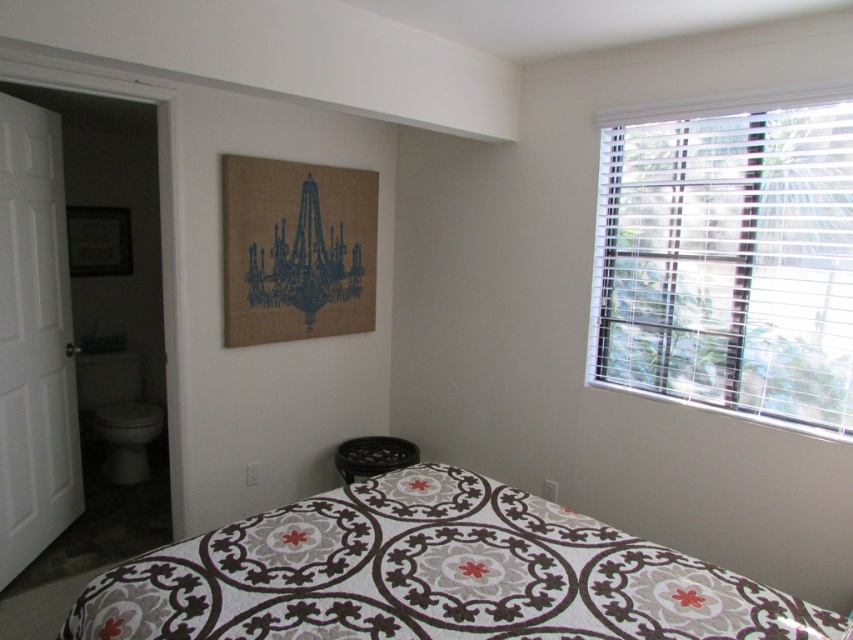
Question: Which object is closer to the camera taking this photo?

Choices:
 (A) patterned fabric bed at center
 (B) white blinds at upper right

Answer: (A)

Question: Which of the following is the closest to the observer?

Choices:
 (A) (767, 257)
 (B) (538, 557)

Answer: (B)

Question: Is patterned fabric bed at center smaller than white blinds at upper right?

Choices:
 (A) yes
 (B) no

Answer: (A)

Question: Which point appears closest to the camera in this image?

Choices:
 (A) (830, 260)
 (B) (473, 592)

Answer: (B)

Question: Considering the relative positions of patterned fabric bed at center and white blinds at upper right in the image provided, where is patterned fabric bed at center located with respect to white blinds at upper right?

Choices:
 (A) below
 (B) above

Answer: (A)

Question: Is patterned fabric bed at center behind white blinds at upper right?

Choices:
 (A) yes
 (B) no

Answer: (B)